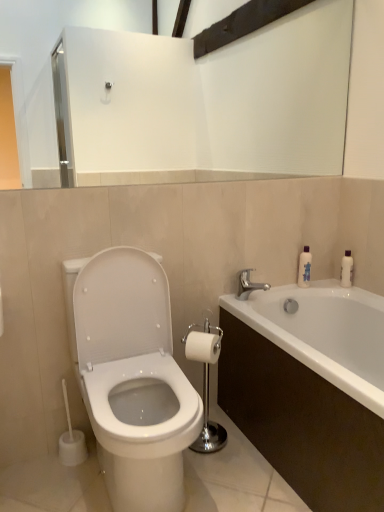
This screenshot has height=512, width=384. What do you see at coordinates (304, 268) in the screenshot?
I see `translucent plastic bottle at upper right` at bounding box center [304, 268].

This screenshot has height=512, width=384. What are the coordinates of `translucent plastic bottle at upper right` in the screenshot? It's located at (304, 268).

This screenshot has height=512, width=384. What are the coordinates of `polished chrome toilet paper holder at center` in the screenshot? It's located at (206, 382).

Describe the element at coordinates (131, 376) in the screenshot. This screenshot has width=384, height=512. I see `white glossy toilet at left` at that location.

Find the location of `white glossy bathtub at lower right`. white glossy bathtub at lower right is located at coordinates (310, 389).

Is polished chrome toilet paper holder at center completely or partially inside white glossy bathtub at lower right?

No, polished chrome toilet paper holder at center is located outside of white glossy bathtub at lower right.

Based on the photo, considering the relative positions of white glossy bathtub at lower right and polished chrome toilet paper holder at center in the image provided, is white glossy bathtub at lower right in front of polished chrome toilet paper holder at center?

That is True.

From a real-world perspective, who is located lower, white glossy bathtub at lower right or polished chrome toilet paper holder at center?

white glossy bathtub at lower right is physically lower.

Between white glossy bathtub at lower right and polished chrome toilet paper holder at center, which one has larger width?

Wider between the two is white glossy bathtub at lower right.

How many degrees apart are the facing directions of white glossy toilet at left and polished chrome toilet paper holder at center?

44.1 degrees.

Considering the relative sizes of white glossy toilet at left and polished chrome toilet paper holder at center in the image provided, is white glossy toilet at left wider than polished chrome toilet paper holder at center?

Indeed, white glossy toilet at left has a greater width compared to polished chrome toilet paper holder at center.

From the image's perspective, is white glossy toilet at left located above or below polished chrome toilet paper holder at center?

white glossy toilet at left is situated higher than polished chrome toilet paper holder at center in the image.

Is white glossy toilet at left positioned beyond the bounds of polished chrome toilet paper holder at center?

Yes, white glossy toilet at left is located beyond the bounds of polished chrome toilet paper holder at center.

Between white glossy toilet at left and white glossy bathtub at lower right, which one has more height?

white glossy toilet at left is taller.

From the image's perspective, which one is positioned higher, white glossy toilet at left or white glossy bathtub at lower right?

white glossy toilet at left, from the image's perspective.

Is white glossy toilet at left positioned beyond the bounds of white glossy bathtub at lower right?

Yes, white glossy toilet at left is outside of white glossy bathtub at lower right.

In the image, is white glossy toilet at left on the left side or the right side of white glossy bathtub at lower right?

From the image, it's evident that white glossy toilet at left is to the left of white glossy bathtub at lower right.

Considering the relative sizes of polished chrome toilet paper holder at center and white matte toilet paper at center in the image provided, is polished chrome toilet paper holder at center wider than white matte toilet paper at center?

Indeed, polished chrome toilet paper holder at center has a greater width compared to white matte toilet paper at center.

Is point (187, 352) closer or farther from the camera than point (185, 347)?

Point (187, 352) is closer to the camera than point (185, 347).

Consider the image. Is polished chrome toilet paper holder at center positioned far away from white matte toilet paper at center?

They are positioned close to each other.

Locate an element on the screen. The width and height of the screenshot is (384, 512). tap located on the right of polished chrome toilet paper holder at center is located at coordinates (249, 285).

Looking at this image, is silver metallic faucet at upper right not near polished chrome toilet paper holder at center?

No, silver metallic faucet at upper right is in close proximity to polished chrome toilet paper holder at center.

Based on the photo, from a real-world perspective, is silver metallic faucet at upper right physically above polished chrome toilet paper holder at center?

Indeed, from a real-world perspective, silver metallic faucet at upper right stands above polished chrome toilet paper holder at center.

Considering the positions of objects silver metallic faucet at upper right and polished chrome toilet paper holder at center in the image provided, who is behind, silver metallic faucet at upper right or polished chrome toilet paper holder at center?

Positioned behind is silver metallic faucet at upper right.

From the image's perspective, is white glossy toilet at left above or below white matte toilet paper at center?

Clearly, from the image's perspective, white glossy toilet at left is below white matte toilet paper at center.

Are white glossy toilet at left and white matte toilet paper at center located far from each other?

No, white glossy toilet at left is in close proximity to white matte toilet paper at center.

Which is farther, (x=119, y=395) or (x=211, y=357)?

Result: The point (x=211, y=357) is farther from the camera.

Which of these two, white glossy toilet at left or white matte toilet paper at center, stands taller?

With more height is white glossy toilet at left.

Which point is more forward, (198, 444) or (274, 420)?

Point (274, 420)

Between polished chrome toilet paper holder at center and white glossy bathtub at lower right, which one has smaller width?

With smaller width is polished chrome toilet paper holder at center.

In the scene shown: Can you confirm if polished chrome toilet paper holder at center is taller than white glossy bathtub at lower right?

Yes, polished chrome toilet paper holder at center is taller than white glossy bathtub at lower right.

Image resolution: width=384 pixels, height=512 pixels. I want to click on towel bar that is behind the white glossy bathtub at lower right, so click(206, 382).

At what (x,y) coordinates should I click in order to perform the action: click on toilet located above the polished chrome toilet paper holder at center (from a real-world perspective). Please return your answer as a coordinate pair (x, y). This screenshot has height=512, width=384. Looking at the image, I should click on (131, 376).

Based on the photo, looking at the image, which one is located closer to polished chrome toilet paper holder at center, silver metallic faucet at upper right or translucent plastic bottle at upper right?

The object closer to polished chrome toilet paper holder at center is silver metallic faucet at upper right.

Which object lies further to the anchor point silver metallic faucet at upper right, translucent plastic bottle at upper right or white glossy toilet at left?

white glossy toilet at left is positioned further to the anchor silver metallic faucet at upper right.

Looking at this image, considering their positions, is white matte toilet paper at center positioned closer to white glossy toilet at left than white glossy bathtub at lower right?

Among the two, white matte toilet paper at center is located nearer to white glossy toilet at left.

Looking at the image, which one is located closer to white matte toilet paper at center, translucent plastic bottle at upper right or white glossy bathtub at lower right?

white glossy bathtub at lower right is closer to white matte toilet paper at center.

Considering their positions, is silver metallic faucet at upper right positioned further to polished chrome toilet paper holder at center than white matte toilet paper at center?

Among the two, silver metallic faucet at upper right is located further to polished chrome toilet paper holder at center.

Considering their positions, is white glossy toilet at left positioned closer to translucent plastic bottle at upper right than silver metallic faucet at upper right?

silver metallic faucet at upper right is closer to translucent plastic bottle at upper right.

Considering their positions, is white glossy toilet at left positioned closer to translucent plastic bottle at upper right than polished chrome toilet paper holder at center?

Among the two, polished chrome toilet paper holder at center is located nearer to translucent plastic bottle at upper right.

Estimate the real-world distances between objects in this image. Which object is further from white glossy toilet at left, polished chrome toilet paper holder at center or silver metallic faucet at upper right?

Based on the image, silver metallic faucet at upper right appears to be further to white glossy toilet at left.

Find the location of `bathtub positioned between white glossy toilet at left and silver metallic faucet at upper right from near to far`. bathtub positioned between white glossy toilet at left and silver metallic faucet at upper right from near to far is located at coordinates (310, 389).

Identify the location of tap located between white glossy toilet at left and translucent plastic bottle at upper right in the depth direction. Image resolution: width=384 pixels, height=512 pixels. (249, 285).

At what (x,y) coordinates should I click in order to perform the action: click on bathtub positioned between white glossy toilet at left and translucent plastic bottle at upper right from near to far. Please return your answer as a coordinate pair (x, y). Looking at the image, I should click on (310, 389).

This screenshot has height=512, width=384. What are the coordinates of `tap between white glossy bathtub at lower right and translucent plastic bottle at upper right from front to back` in the screenshot? It's located at (249, 285).